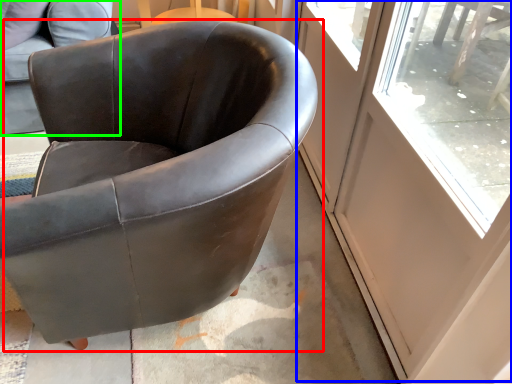
Question: Which is farther away from chair (highlighted by a red box)? screen door (highlighted by a blue box) or chair (highlighted by a green box)?

Choices:
 (A) screen door
 (B) chair

Answer: (A)